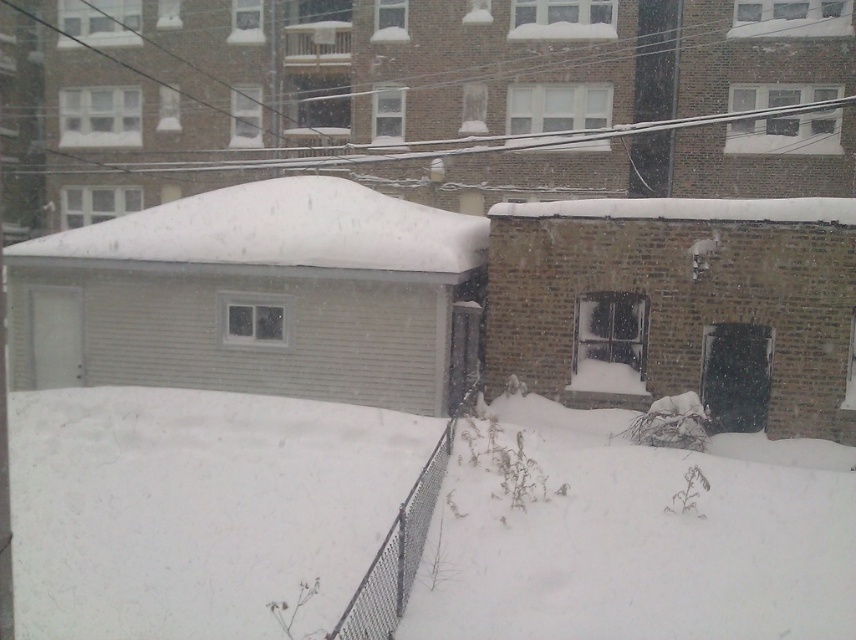
You are a delivery person trying to navigate through the snowy area. You see two patches of white fluffy snow at lower left and white fluffy snow at center. Which snow patch is located to the right of the other?

The white fluffy snow at lower left is positioned on the right side of white fluffy snow at center, so the white fluffy snow at lower left is to the right of the white fluffy snow at center.

You are a snowplow operator trying to clear snow from the fenced area. You notice two patches of white fluffy snow at lower left and white fluffy snow at center. Which patch requires more effort to remove based on their sizes?

The white fluffy snow at lower left requires more effort to remove because it is larger in size than the white fluffy snow at center.